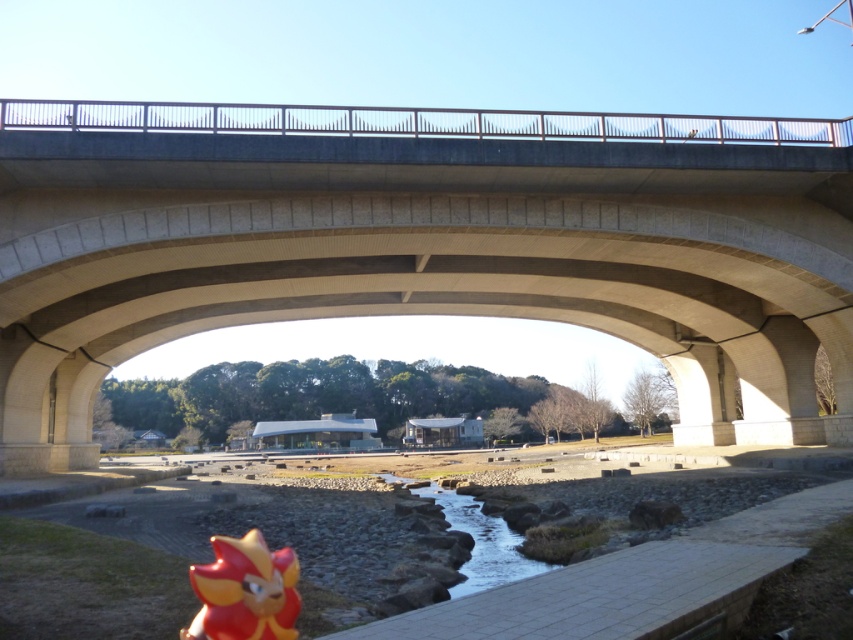
Question: Which point appears farthest from the camera in this image?

Choices:
 (A) [x=474, y=541]
 (B) [x=215, y=636]
 (C) [x=648, y=196]

Answer: (C)

Question: Among these points, which one is nearest to the camera?

Choices:
 (A) (277, 602)
 (B) (502, 547)

Answer: (A)

Question: Does concrete bridge at upper center appear over clear stone waterway at center?

Choices:
 (A) yes
 (B) no

Answer: (A)

Question: Which point is closer to the camera?

Choices:
 (A) (218, 548)
 (B) (35, 308)
 (C) (520, 563)

Answer: (A)

Question: Can you confirm if concrete bridge at upper center is bigger than clear stone waterway at center?

Choices:
 (A) yes
 (B) no

Answer: (A)

Question: Does shiny red plastic toy at lower left appear over clear stone waterway at center?

Choices:
 (A) no
 (B) yes

Answer: (B)